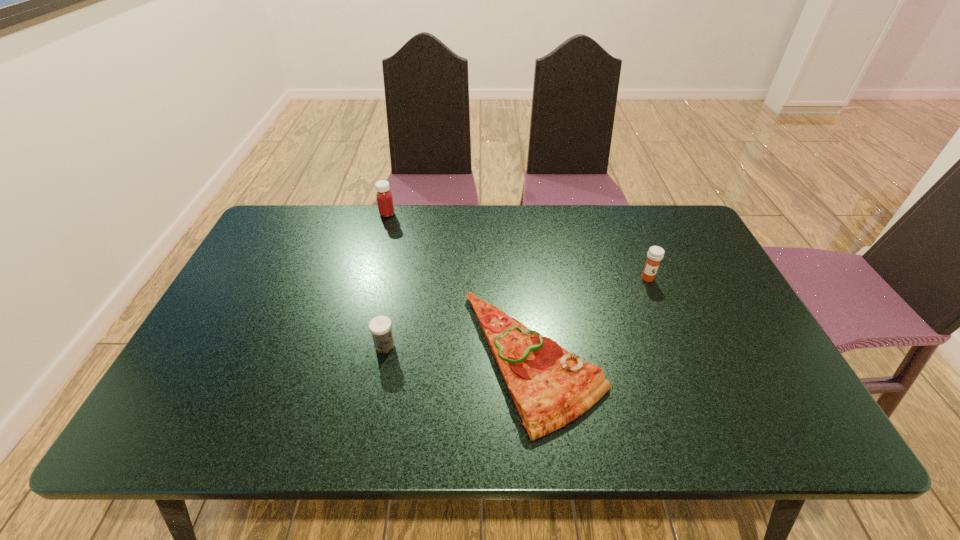
You are a GUI agent. You are given a task and a screenshot of the screen. Output one action in this format:
    pyautogui.click(x=<x>, y=<y>)
    Task: Click on the object that is the closest to the nearest medicine
    The height and width of the screenshot is (540, 960).
    Given the screenshot: What is the action you would take?
    pyautogui.click(x=550, y=387)

Identify which object is the third nearest to the farthest medicine. Please provide its 2D coordinates. Your answer should be formatted as a tuple, i.e. [(x, y)], where the tuple contains the x and y coordinates of a point satisfying the conditions above.

[(655, 254)]

Point out which medicine is positioned as the nearest to the leftmost object. Please provide its 2D coordinates. Your answer should be formatted as a tuple, i.e. [(x, y)], where the tuple contains the x and y coordinates of a point satisfying the conditions above.

[(380, 326)]

Choose which medicine is the nearest neighbor to the rightmost object. Please provide its 2D coordinates. Your answer should be formatted as a tuple, i.e. [(x, y)], where the tuple contains the x and y coordinates of a point satisfying the conditions above.

[(380, 326)]

Identify the location of vacant region that satisfies the following two spatial constraints: 1. on the front side of the pizza; 2. on the right side of the second medicine from left to right. The image size is (960, 540). (382, 359).